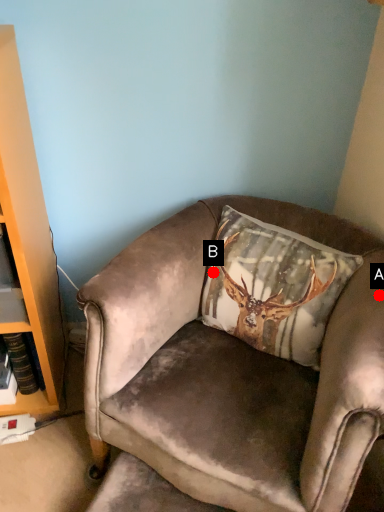
Question: Two points are circled on the image, labeled by A and B beside each circle. Which point is closer to the camera?

Choices:
 (A) A is closer
 (B) B is closer

Answer: (A)